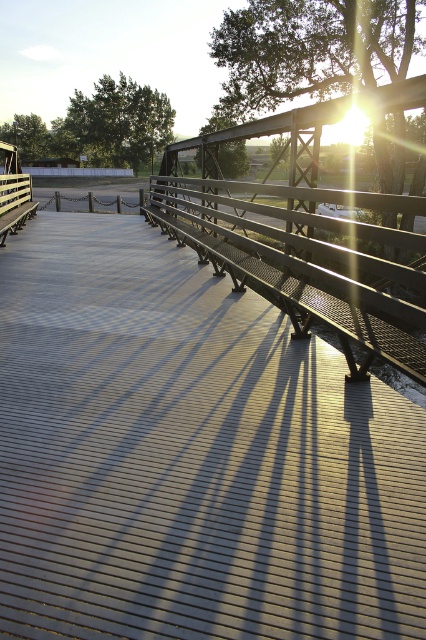
Does point (374, 524) come farther from viewer compared to point (250, 237)?

No, (374, 524) is in front of (250, 237).

Can you confirm if metallic gray dock at center is positioned below metallic gray bench at center?

Indeed, metallic gray dock at center is positioned under metallic gray bench at center.

Identify the location of metallic gray dock at center. (190, 456).

Where is `metallic gray dock at center`? metallic gray dock at center is located at coordinates (190, 456).